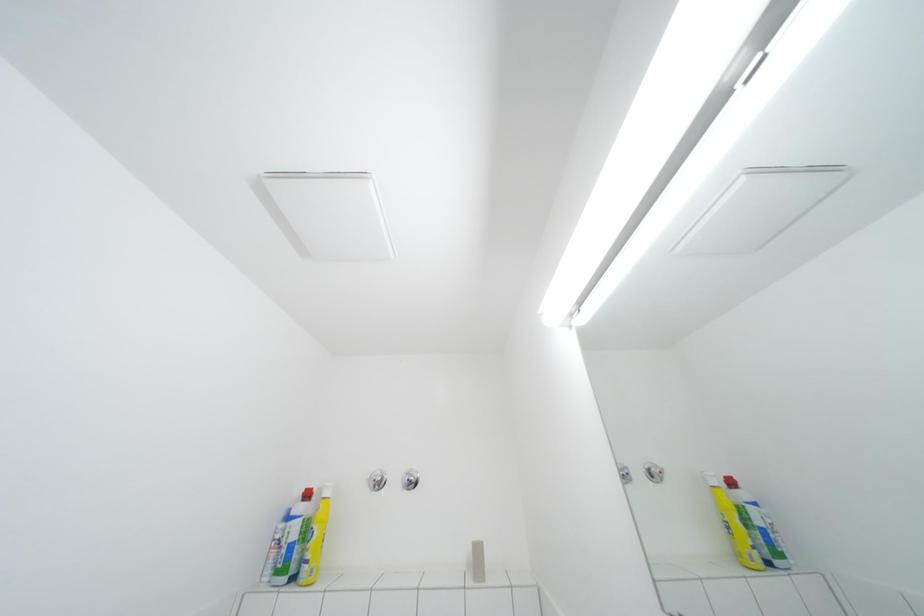
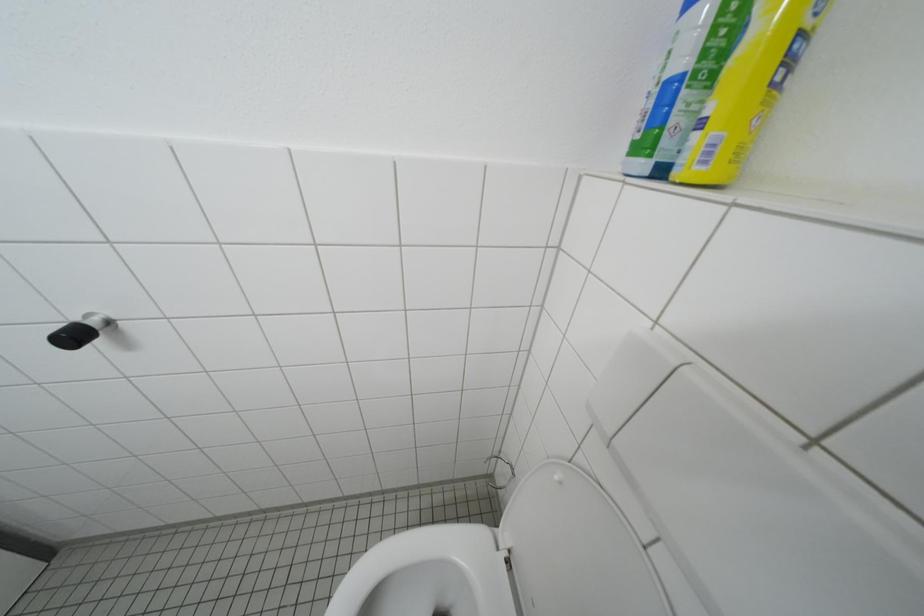
The images are taken continuously from a first-person perspective. In which direction is your viewpoint rotating?

The rotation direction of the camera is left-down.